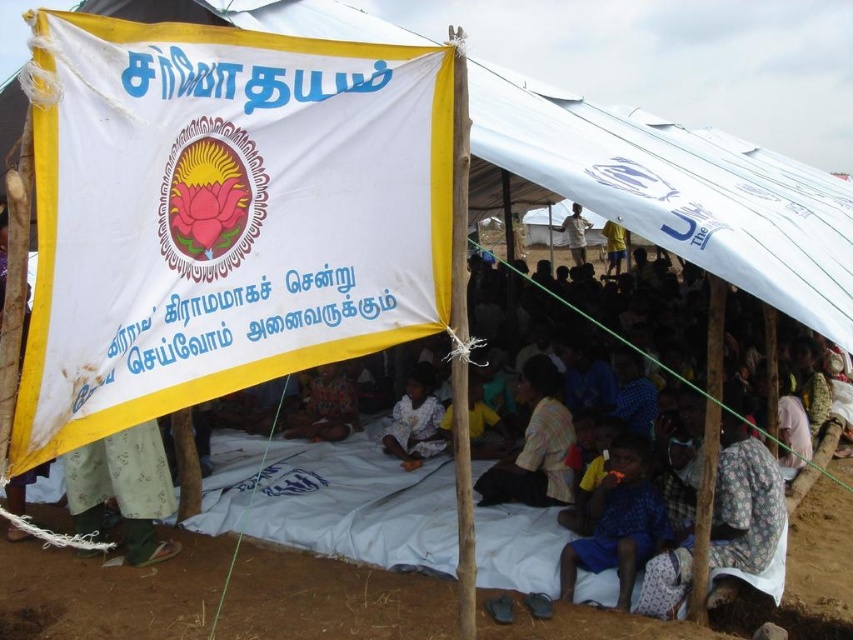
You are standing at the entrance of the shelter and see two points marked on the ground. The first point is at coordinates point (636, 513) and the second is at point (543, 500). Which point is closer to the entrance of the shelter?

Point (636, 513) is in front of point (543, 500), so it is closer to the entrance of the shelter.

You are setting up a temporary camp and need to hang a new flag. The dark blue fabric at lower center and the light brown fabric at center are already present. Which fabric should you place your new flag behind to ensure it is visible from the front of the shelter?

You should place your new flag behind the dark blue fabric at lower center because it is in front of the light brown fabric at center, making it more visible from the front.